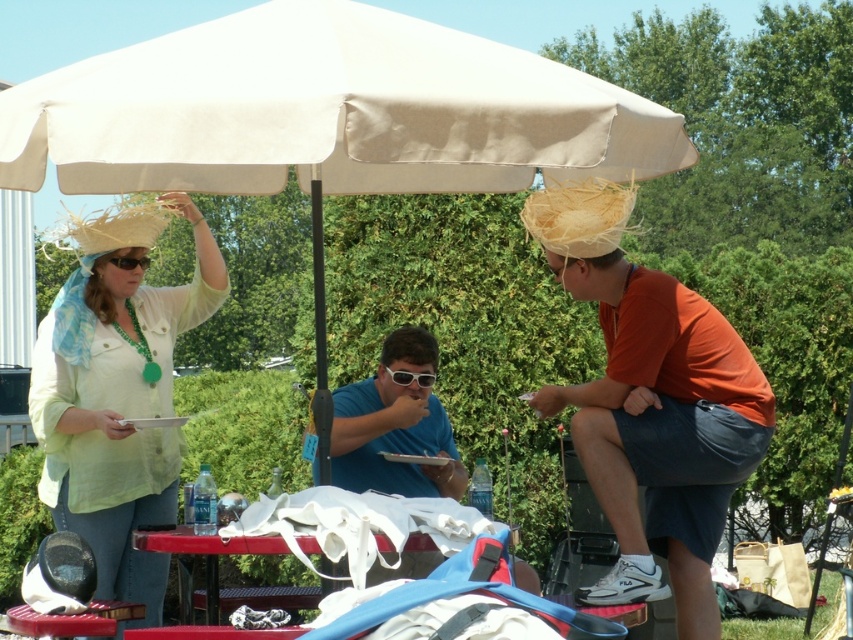
Is matte straw hat at left bigger than white fabric table at center?

Correct, matte straw hat at left is larger in size than white fabric table at center.

Is matte straw hat at left thinner than white fabric table at center?

Yes, matte straw hat at left is thinner than white fabric table at center.

Describe the element at coordinates (117, 406) in the screenshot. I see `matte straw hat at left` at that location.

At what (x,y) coordinates should I click in order to perform the action: click on matte straw hat at left. Please return your answer as a coordinate pair (x, y). The height and width of the screenshot is (640, 853). Looking at the image, I should click on (117, 406).

Is matte straw hat at left shorter than white plastic goggles at center?

No, matte straw hat at left is not shorter than white plastic goggles at center.

From the picture: Does matte straw hat at left appear on the right side of white plastic goggles at center?

Incorrect, matte straw hat at left is not on the right side of white plastic goggles at center.

Is point (114, 465) in front of point (413, 372)?

That is True.

Where is `matte straw hat at left`? This screenshot has width=853, height=640. matte straw hat at left is located at coordinates (117, 406).

Which is more to the left, orange cotton shirt at right or matte yellow goggles at upper left?

matte yellow goggles at upper left

This screenshot has height=640, width=853. I want to click on orange cotton shirt at right, so (651, 404).

This screenshot has width=853, height=640. What are the coordinates of `orange cotton shirt at right` in the screenshot? It's located at (651, 404).